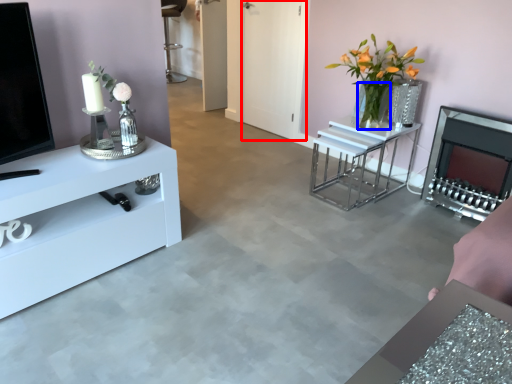
Question: Which point is closer to the camera, glass door (highlighted by a red box) or glass vase (highlighted by a blue box)?

Choices:
 (A) glass door
 (B) glass vase

Answer: (B)